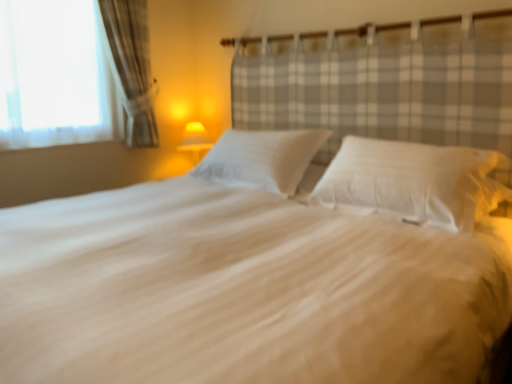
What is the approximate height of white soft pillow at center, the 1th pillow from the right?

white soft pillow at center, the 1th pillow from the right, is 12.99 inches tall.

Describe the element at coordinates (262, 158) in the screenshot. I see `white soft pillow at center, the second pillow from the right` at that location.

What do you see at coordinates (195, 140) in the screenshot?
I see `yellow fabric lampshade at center` at bounding box center [195, 140].

Locate an element on the screen. This screenshot has width=512, height=384. white soft pillow at center, marked as the 2th pillow in a left-to-right arrangement is located at coordinates (414, 181).

From the image's perspective, between yellow fabric lampshade at center and white soft pillow at center, positioned as the first pillow in left-to-right order, who is located below?

white soft pillow at center, positioned as the first pillow in left-to-right order, is shown below in the image.

From a real-world perspective, is yellow fabric lampshade at center positioned under white soft pillow at center, the second pillow from the right, based on gravity?

Yes, from a real-world perspective, yellow fabric lampshade at center is beneath white soft pillow at center, the second pillow from the right.

Is yellow fabric lampshade at center further to camera compared to white soft pillow at center, the second pillow from the right?

Yes.

Looking at this image, do you think yellow fabric lampshade at center is within white soft pillow at center, the second pillow from the right, or outside of it?

The correct answer is: outside.

Which of these two, white soft pillow at center, positioned as the first pillow in left-to-right order, or yellow fabric lampshade at center, stands shorter?

white soft pillow at center, positioned as the first pillow in left-to-right order.

Considering the points (251, 146) and (180, 143), which point is in front, point (251, 146) or point (180, 143)?

Point (251, 146)

What's the angular difference between white soft pillow at center, the second pillow from the right, and yellow fabric lampshade at center's facing directions?

The angle between the facing direction of white soft pillow at center, the second pillow from the right, and the facing direction of yellow fabric lampshade at center is 0.202 degrees.

Is white soft pillow at center, positioned as the first pillow in left-to-right order, oriented towards yellow fabric lampshade at center?

No.

Is white soft bed at center not within white soft pillow at center, positioned as the first pillow in left-to-right order?

→ Yes, white soft bed at center is located beyond the bounds of white soft pillow at center, positioned as the first pillow in left-to-right order.

Is white soft bed at center taller or shorter than white soft pillow at center, positioned as the first pillow in left-to-right order?

Considering their sizes, white soft bed at center has more height than white soft pillow at center, positioned as the first pillow in left-to-right order.

How different are the orientations of white soft bed at center and white soft pillow at center, the second pillow from the right, in degrees?

The facing directions of white soft bed at center and white soft pillow at center, the second pillow from the right, are 0.834 degrees apart.

Which object is more forward, white soft bed at center or white soft pillow at center, positioned as the first pillow in left-to-right order?

white soft bed at center is more forward.

Considering the relative positions of yellow fabric lampshade at center and white soft bed at center in the image provided, is yellow fabric lampshade at center in front of white soft bed at center?

No, the depth of yellow fabric lampshade at center is greater than that of white soft bed at center.

From the picture: Can you tell me how much yellow fabric lampshade at center and white soft bed at center differ in facing direction?

0.633 degrees.

Find the location of a particular element. bed in front of the yellow fabric lampshade at center is located at coordinates (264, 270).

Is white soft pillow at center, the 1th pillow from the right, smaller than white soft bed at center?

Correct, white soft pillow at center, the 1th pillow from the right, occupies less space than white soft bed at center.

How different are the orientations of white soft pillow at center, the 1th pillow from the right, and white soft bed at center in degrees?

The angle between the facing direction of white soft pillow at center, the 1th pillow from the right, and the facing direction of white soft bed at center is 0.835 degrees.

Between white soft pillow at center, marked as the 2th pillow in a left-to-right arrangement, and white soft bed at center, which one has more height?

white soft bed at center.

Does white soft pillow at center, marked as the 2th pillow in a left-to-right arrangement, appear on the right side of white soft bed at center?

Yes.

Considering the relative positions of white soft bed at center and white soft pillow at center, the 1th pillow from the right, in the image provided, is white soft bed at center to the right of white soft pillow at center, the 1th pillow from the right, from the viewer's perspective?

Incorrect, white soft bed at center is not on the right side of white soft pillow at center, the 1th pillow from the right.

How far apart are white soft bed at center and white soft pillow at center, marked as the 2th pillow in a left-to-right arrangement?

The distance of white soft bed at center from white soft pillow at center, marked as the 2th pillow in a left-to-right arrangement, is 12.37 inches.

Is white soft bed at center placed right next to white soft pillow at center, the 1th pillow from the right?

No, white soft bed at center is not in contact with white soft pillow at center, the 1th pillow from the right.

From a real-world perspective, is white soft bed at center positioned above or below yellow fabric lampshade at center?

In terms of real-world spatial position, white soft bed at center is below yellow fabric lampshade at center.

Which is nearer, (145, 273) or (195, 144)?

Point (145, 273).

Considering the sizes of objects white soft bed at center and yellow fabric lampshade at center in the image provided, who is bigger, white soft bed at center or yellow fabric lampshade at center?

white soft bed at center is bigger.

Measure the distance from white soft bed at center to yellow fabric lampshade at center.

A distance of 1.85 meters exists between white soft bed at center and yellow fabric lampshade at center.

Locate an element on the screen. The height and width of the screenshot is (384, 512). the 2nd pillow above the yellow fabric lampshade at center (from a real-world perspective) is located at coordinates (262, 158).

You are a GUI agent. You are given a task and a screenshot of the screen. Output one action in this format:
    pyautogui.click(x=<x>, y=<y>)
    Task: Click on the 1st pillow positioned below the yellow fabric lampshade at center (from the image's perspective)
    
    Given the screenshot: What is the action you would take?
    pyautogui.click(x=262, y=158)

Considering their positions, is white soft pillow at center, the 1th pillow from the right, positioned further to yellow fabric lampshade at center than white soft pillow at center, the second pillow from the right?

Among the two, white soft pillow at center, the 1th pillow from the right, is located further to yellow fabric lampshade at center.

Consider the image. When comparing their distances from white soft pillow at center, marked as the 2th pillow in a left-to-right arrangement, does yellow fabric lampshade at center or white soft pillow at center, positioned as the first pillow in left-to-right order, seem closer?

white soft pillow at center, positioned as the first pillow in left-to-right order, is closer to white soft pillow at center, marked as the 2th pillow in a left-to-right arrangement.

When comparing their distances from white soft bed at center, does white soft pillow at center, the second pillow from the right, or yellow fabric lampshade at center seem further?

The object further to white soft bed at center is yellow fabric lampshade at center.

Estimate the real-world distances between objects in this image. Which object is further from white soft pillow at center, the second pillow from the right, yellow fabric lampshade at center or white soft pillow at center, the 1th pillow from the right?

yellow fabric lampshade at center is positioned further to the anchor white soft pillow at center, the second pillow from the right.

From the image, which object appears to be nearer to white soft pillow at center, the 1th pillow from the right, white soft pillow at center, the second pillow from the right, or yellow fabric lampshade at center?

Among the two, white soft pillow at center, the second pillow from the right, is located nearer to white soft pillow at center, the 1th pillow from the right.

When comparing their distances from white soft bed at center, does yellow fabric lampshade at center or white soft pillow at center, the second pillow from the right, seem further?

yellow fabric lampshade at center is further to white soft bed at center.

When comparing their distances from white soft pillow at center, the 1th pillow from the right, does white soft pillow at center, the second pillow from the right, or white soft bed at center seem closer?

Based on the image, white soft bed at center appears to be nearer to white soft pillow at center, the 1th pillow from the right.

Based on their spatial positions, is white soft bed at center or yellow fabric lampshade at center closer to white soft pillow at center, the second pillow from the right?

white soft bed at center is closer to white soft pillow at center, the second pillow from the right.

What are the coordinates of `pillow between white soft pillow at center, marked as the 2th pillow in a left-to-right arrangement, and yellow fabric lampshade at center from front to back` in the screenshot? It's located at (262, 158).

Locate an element on the screen. The image size is (512, 384). pillow positioned between white soft bed at center and white soft pillow at center, positioned as the first pillow in left-to-right order, from near to far is located at coordinates (414, 181).